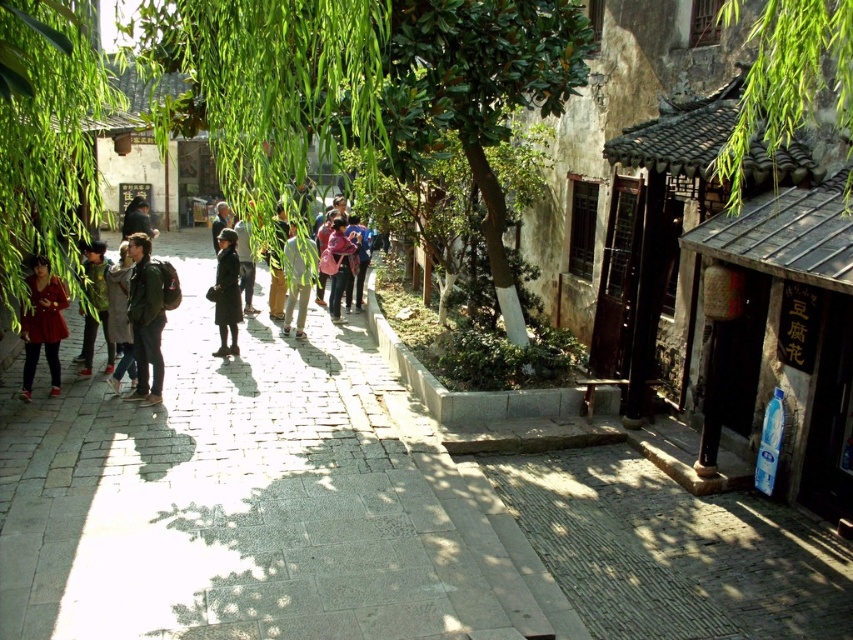
Question: Estimate the real-world distances between objects in this image. Which object is closer to the green leafy tree at left?

Choices:
 (A) gray stone pavement at center
 (B) green matte jacket at left

Answer: (B)

Question: From the image, what is the correct spatial relationship of green fabric jacket at left in relation to dark green jacket at center?

Choices:
 (A) below
 (B) above

Answer: (A)

Question: Which of the following is the farthest from the observer?

Choices:
 (A) (282, 289)
 (B) (756, 125)
 (C) (61, 323)

Answer: (A)

Question: Does green matte jacket at left come behind green fabric jacket at left?

Choices:
 (A) yes
 (B) no

Answer: (B)

Question: Which point is farther from the camera taking this photo?

Choices:
 (A) (227, 320)
 (B) (248, 275)
 (C) (120, 289)

Answer: (B)

Question: In this image, where is green leafy tree at left located relative to dark gray jacket at center?

Choices:
 (A) left
 (B) right

Answer: (B)